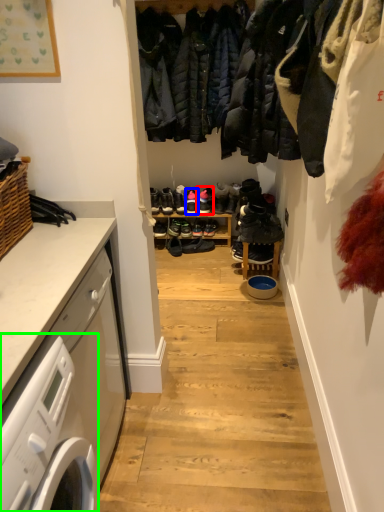
Question: Considering the real-world distances, which object is closest to footwear (highlighted by a red box)? footwear (highlighted by a blue box) or washing machine (highlighted by a green box).

Choices:
 (A) footwear
 (B) washing machine

Answer: (A)